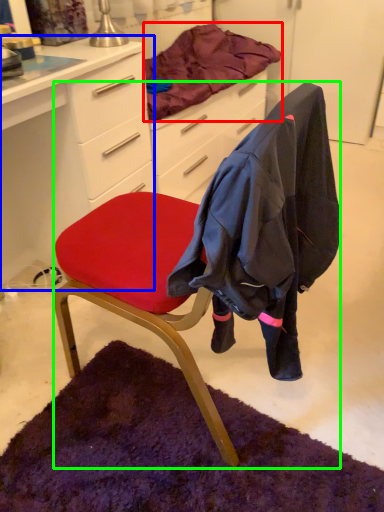
Question: Estimate the real-world distances between objects in this image. Which object is farther from blanket (highlighted by a red box), desk (highlighted by a blue box) or chair (highlighted by a green box)?

Choices:
 (A) desk
 (B) chair

Answer: (B)